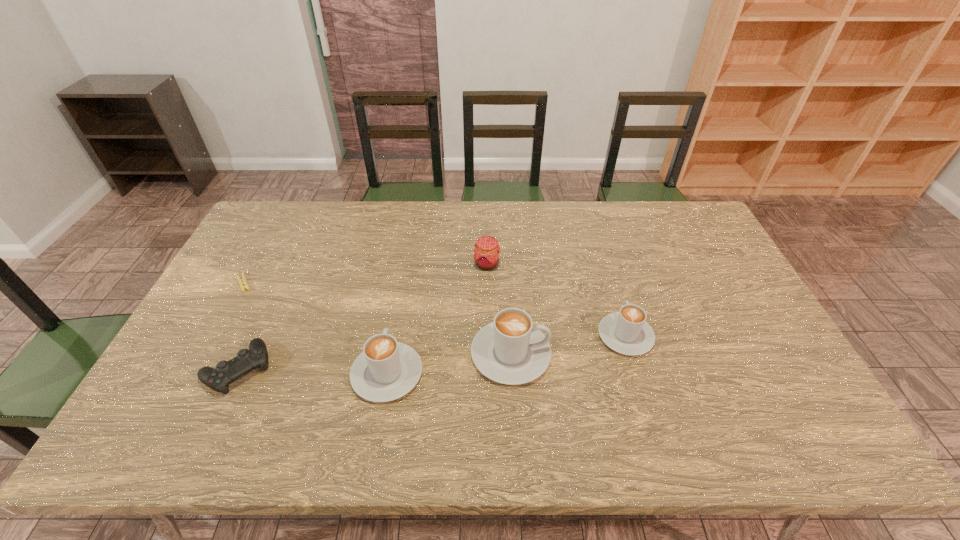
Find the location of a particular element. This screenshot has width=960, height=540. unoccupied area between the jam and the second shortest object is located at coordinates (x=363, y=316).

Locate an element on the screen. Image resolution: width=960 pixels, height=540 pixels. vacant area that lies between the second cappuccino from right to left and the fourth object from right to left is located at coordinates (449, 364).

Locate an element on the screen. The height and width of the screenshot is (540, 960). free spot between the second cappuccino from left to right and the second tallest object is located at coordinates pyautogui.click(x=449, y=364).

You are a GUI agent. You are given a task and a screenshot of the screen. Output one action in this format:
    pyautogui.click(x=<x>, y=<y>)
    Task: Click on the free space between the third object from left to right and the control
    This screenshot has width=960, height=540.
    Given the screenshot: What is the action you would take?
    pyautogui.click(x=313, y=372)

The width and height of the screenshot is (960, 540). Identify the location of free point between the fourth object from right to left and the second cappuccino from left to right. (449, 364).

The width and height of the screenshot is (960, 540). Identify the location of object that stands as the fifth closest to the rightmost cappuccino. (243, 285).

Identify which object is located as the nearest to the rightmost cappuccino. Please provide its 2D coordinates. Your answer should be formatted as a tuple, i.e. [(x, y)], where the tuple contains the x and y coordinates of a point satisfying the conditions above.

[(511, 350)]

Identify which cappuccino is located as the second nearest to the leftmost cappuccino. Please provide its 2D coordinates. Your answer should be formatted as a tuple, i.e. [(x, y)], where the tuple contains the x and y coordinates of a point satisfying the conditions above.

[(627, 332)]

You are a GUI agent. You are given a task and a screenshot of the screen. Output one action in this format:
    pyautogui.click(x=<x>, y=<y>)
    Task: Click on the second closest cappuccino to the jam
    
    Given the screenshot: What is the action you would take?
    pyautogui.click(x=386, y=370)

Find the location of a particular element. The width and height of the screenshot is (960, 540). vacant space that satisfies the following two spatial constraints: 1. to the right of the second cappuccino from left to right; 2. on the front side of the second shortest object is located at coordinates (512, 369).